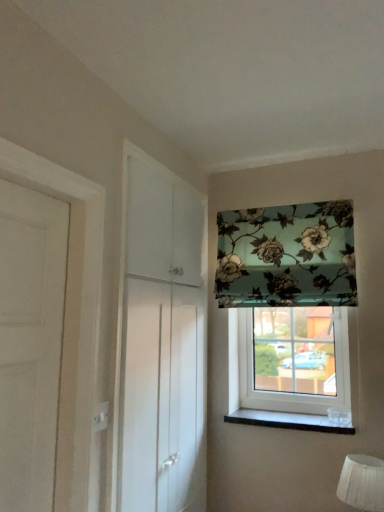
Question: Would you say black marble window sill at lower right is to the left or to the right of floral fabric at upper right, which appears as the 2th window when ordered from the bottom, in the picture?

Choices:
 (A) right
 (B) left

Answer: (A)

Question: Is point (241, 417) positioned closer to the camera than point (349, 258)?

Choices:
 (A) closer
 (B) farther

Answer: (B)

Question: Which of these objects is positioned farthest from the white fabric lampshade at lower right?

Choices:
 (A) floral fabric at upper right, which ranks as the 1th window in top-to-bottom order
 (B) white glossy cabinet at left
 (C) black marble window sill at lower right
 (D) transparent glass window at center, which is counted as the second window, starting from the top

Answer: (B)

Question: Which of these objects is positioned farthest from the transparent glass window at center, arranged as the first window when ordered from the bottom?

Choices:
 (A) black marble window sill at lower right
 (B) white glossy cabinet at left
 (C) white fabric lampshade at lower right
 (D) floral fabric at upper right, which ranks as the 1th window in top-to-bottom order

Answer: (B)